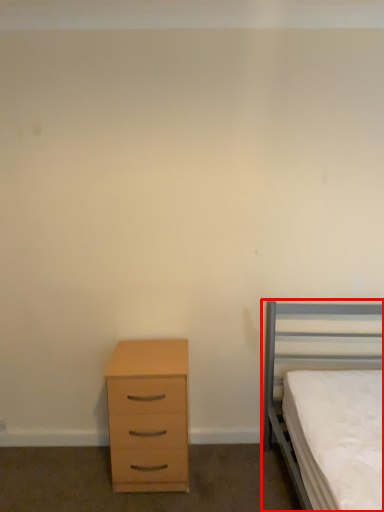
Question: In this image, where is bed (annotated by the red box) located relative to chest of drawers?

Choices:
 (A) left
 (B) right

Answer: (B)